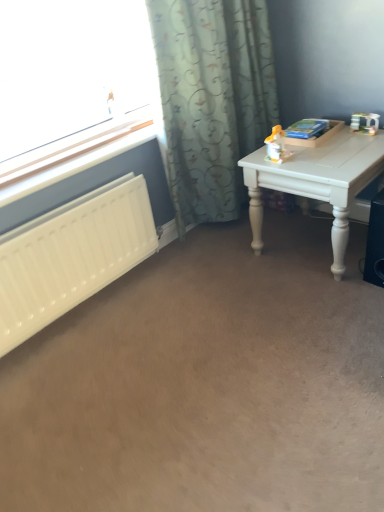
Locate an element on the screen. The height and width of the screenshot is (512, 384). free point above white plastic radiator at left (from a real-world perspective) is located at coordinates (82, 152).